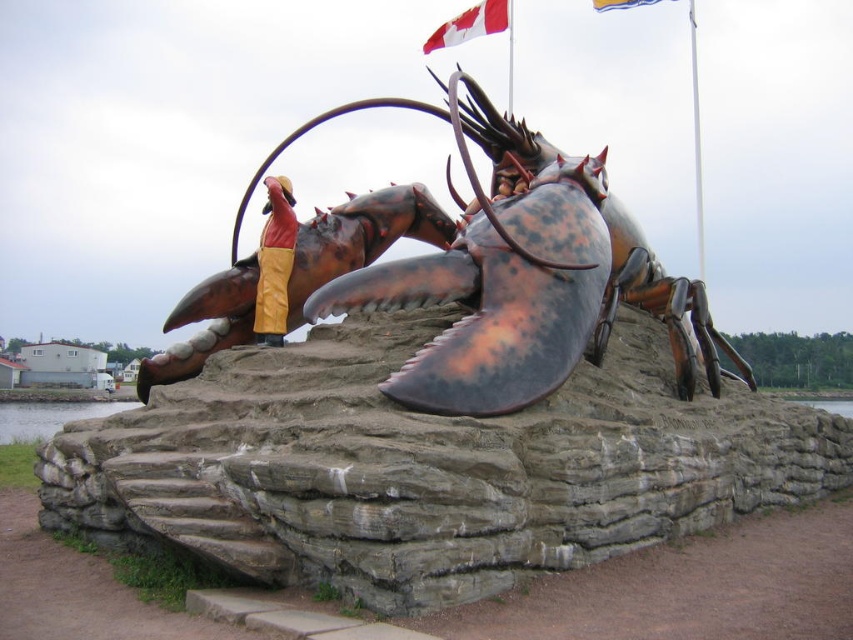
Can you confirm if rustic copper lobster at center is wider than reddish-brown leather pants at center?

Correct, the width of rustic copper lobster at center exceeds that of reddish-brown leather pants at center.

Is rustic copper lobster at center thinner than reddish-brown leather pants at center?

No.

Who is more distant from viewer, (306, 289) or (263, 253)?

The point (306, 289) is behind.

You are a GUI agent. You are given a task and a screenshot of the screen. Output one action in this format:
    pyautogui.click(x=<x>, y=<y>)
    Task: Click on the rustic copper lobster at center
    
    Given the screenshot: What is the action you would take?
    pyautogui.click(x=361, y=236)

Does rustic metal lobster at center have a larger size compared to reddish-brown leather pants at center?

Yes.

Locate an element on the screen. Image resolution: width=853 pixels, height=640 pixels. rustic metal lobster at center is located at coordinates (498, 269).

At what (x,y) coordinates should I click in order to perform the action: click on rustic metal lobster at center. Please return your answer as a coordinate pair (x, y). Image resolution: width=853 pixels, height=640 pixels. Looking at the image, I should click on (498, 269).

Is rustic copper lobster at center taller than red fabric flag at upper center?

Incorrect, rustic copper lobster at center's height is not larger of red fabric flag at upper center's.

Does rustic copper lobster at center have a larger size compared to red fabric flag at upper center?

No, rustic copper lobster at center is not bigger than red fabric flag at upper center.

Identify the location of rustic copper lobster at center. This screenshot has width=853, height=640. (361, 236).

Where is `rustic copper lobster at center`? The height and width of the screenshot is (640, 853). rustic copper lobster at center is located at coordinates (361, 236).